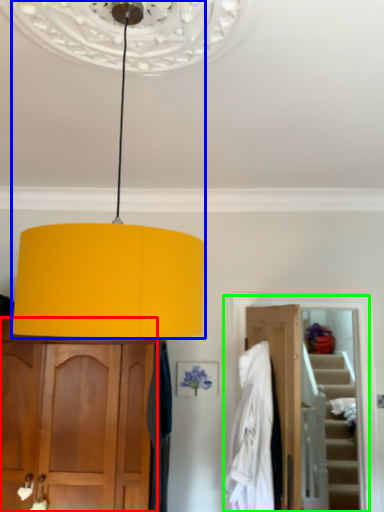
Question: Estimate the real-world distances between objects in this image. Which object is farther from cabinetry (highlighted by a red box), lamp (highlighted by a blue box) or closet (highlighted by a green box)?

Choices:
 (A) lamp
 (B) closet

Answer: (A)